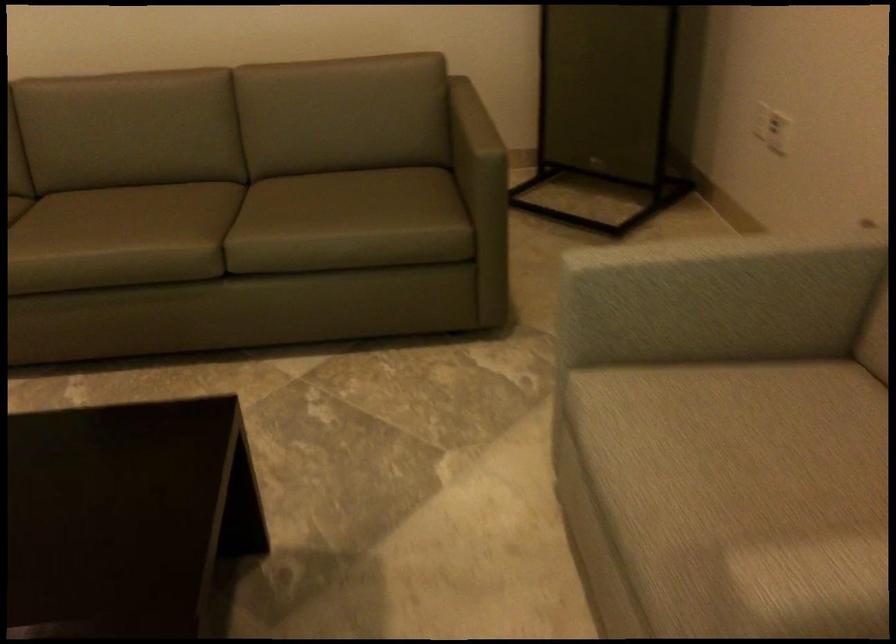
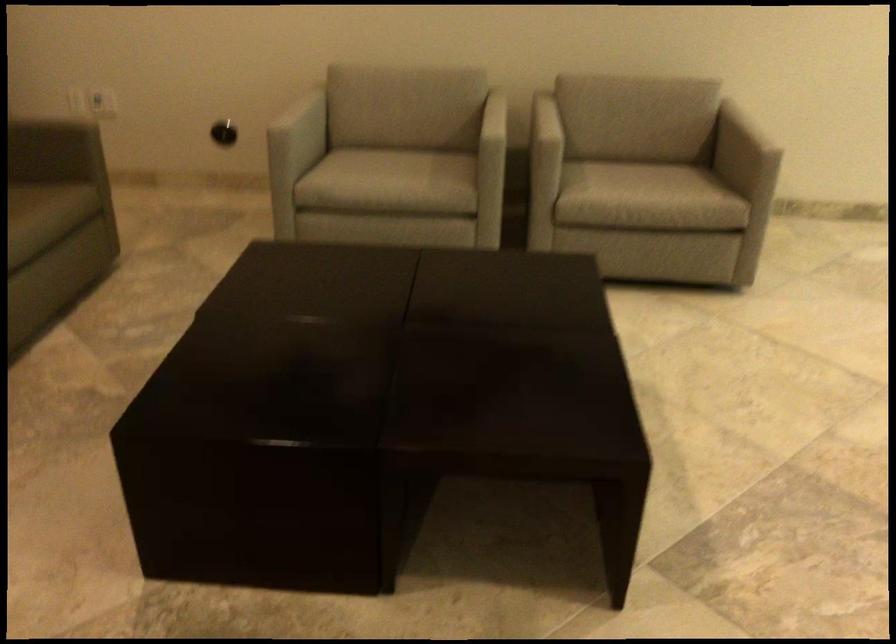
Where in the second image is the point corresponding to pixel 380 247 from the first image?

(36, 219)